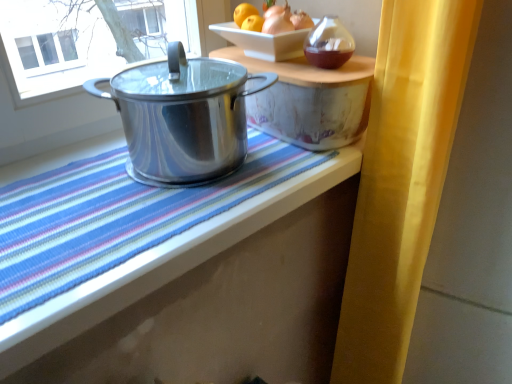
Question: Is shiny metallic pot at left wider or thinner than yellow fabric curtain at right?

Choices:
 (A) thin
 (B) wide

Answer: (A)

Question: Based on their positions, is shiny metallic pot at left located to the left or right of yellow fabric curtain at right?

Choices:
 (A) left
 (B) right

Answer: (A)

Question: Estimate the real-world distances between objects in this image. Which object is farther from the shiny metallic pot at right, acting as the second table starting from the left?

Choices:
 (A) shiny metallic pot at left
 (B) yellow fabric curtain at right
 (C) shiny metallic pot at center, which ranks as the first table in left-to-right order

Answer: (C)

Question: Which is nearer to the shiny metallic pot at center, marked as the second table in a right-to-left arrangement?

Choices:
 (A) yellow fabric curtain at right
 (B) shiny metallic pot at right, acting as the second table starting from the left
 (C) shiny metallic pot at left

Answer: (A)